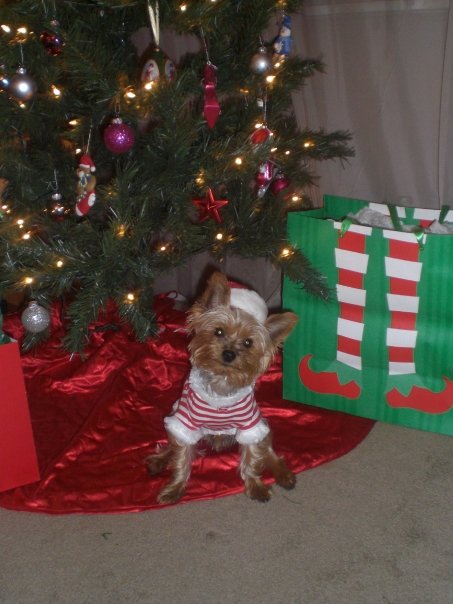
Locate an element on the screen. The width and height of the screenshot is (453, 604). tree skirt is located at coordinates (111, 435).